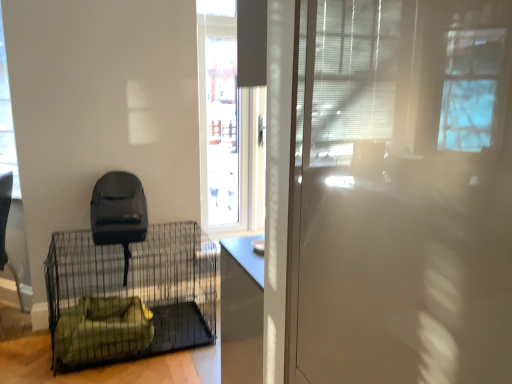
Question: In the image, is green fabric pet bed at lower left on the left side or the right side of transparent glass window at upper left?

Choices:
 (A) left
 (B) right

Answer: (B)

Question: Looking at the image, does green fabric pet bed at lower left seem bigger or smaller compared to transparent glass window at upper left?

Choices:
 (A) big
 (B) small

Answer: (A)

Question: Is green fabric pet bed at lower left wider or thinner than transparent glass window at upper left?

Choices:
 (A) thin
 (B) wide

Answer: (B)

Question: Is transparent glass window at upper left inside or outside of green fabric pet bed at lower left?

Choices:
 (A) outside
 (B) inside

Answer: (A)

Question: Considering the positions of transparent glass window at upper left and green fabric pet bed at lower left in the image, is transparent glass window at upper left wider or thinner than green fabric pet bed at lower left?

Choices:
 (A) wide
 (B) thin

Answer: (B)

Question: In the image, is transparent glass window at upper left on the left side or the right side of green fabric pet bed at lower left?

Choices:
 (A) right
 (B) left

Answer: (B)

Question: Is transparent glass window at upper left in front of or behind green fabric pet bed at lower left in the image?

Choices:
 (A) behind
 (B) front

Answer: (A)